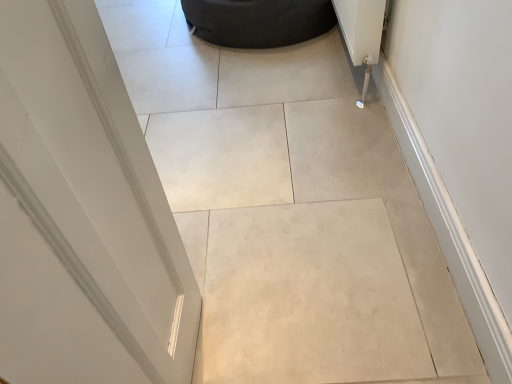
At what (x,y) coordinates should I click in order to perform the action: click on free space in front of dark gray fabric bean bag at upper center. Please return your answer as a coordinate pair (x, y). Looking at the image, I should click on (245, 86).